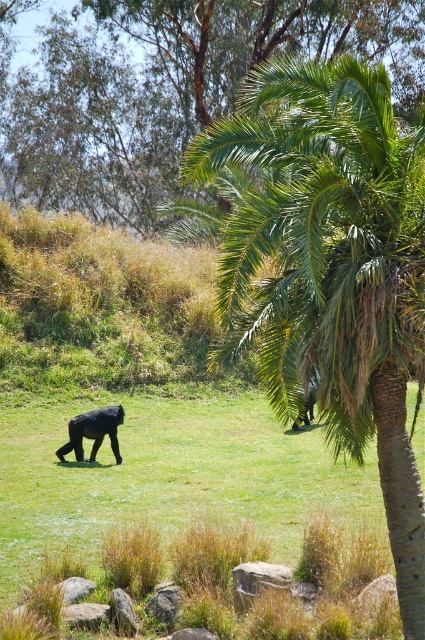
Can you confirm if green leafy palm tree at center is wider than green leafy palm at upper center?

In fact, green leafy palm tree at center might be narrower than green leafy palm at upper center.

Does point (300, 292) lie behind point (101, 212)?

No, it is in front of (101, 212).

At what (x,y) coordinates should I click in order to perform the action: click on green leafy palm tree at center. Please return your answer as a coordinate pair (x, y). This screenshot has height=640, width=425. Looking at the image, I should click on (331, 268).

In the scene shown: Which is below, green leafy palm tree at center or shiny black gorilla at center?

shiny black gorilla at center

In the scene shown: Does green leafy palm tree at center have a greater width compared to shiny black gorilla at center?

Correct, the width of green leafy palm tree at center exceeds that of shiny black gorilla at center.

The width and height of the screenshot is (425, 640). What do you see at coordinates (331, 268) in the screenshot?
I see `green leafy palm tree at center` at bounding box center [331, 268].

Locate an element on the screen. green leafy palm tree at center is located at coordinates (331, 268).

Does green leafy palm at upper center have a smaller size compared to shiny black gorilla at center?

No, green leafy palm at upper center is not smaller than shiny black gorilla at center.

Is point (323, 24) positioned after point (68, 420)?

Yes, point (323, 24) is farther from viewer.

Between point (217, 65) and point (112, 426), which one is positioned in front?

Point (112, 426) is in front.

Where is `green leafy palm at upper center`? The image size is (425, 640). green leafy palm at upper center is located at coordinates (169, 90).